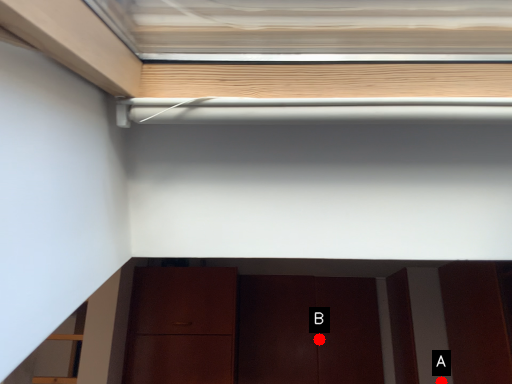
Question: Two points are circled on the image, labeled by A and B beside each circle. Which of the following is the farthest from the observer?

Choices:
 (A) A is further
 (B) B is further

Answer: (B)